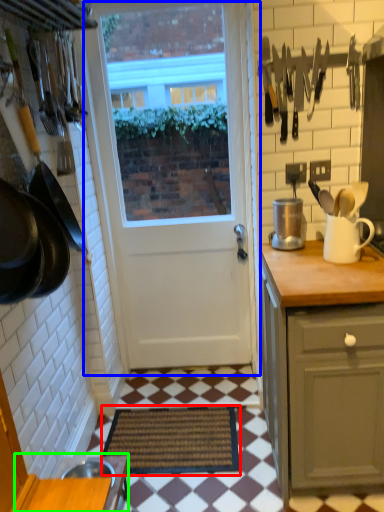
Question: Which is farther away from doormat (highlighted by a red box)? door (highlighted by a blue box) or table (highlighted by a green box)?

Choices:
 (A) door
 (B) table

Answer: (A)